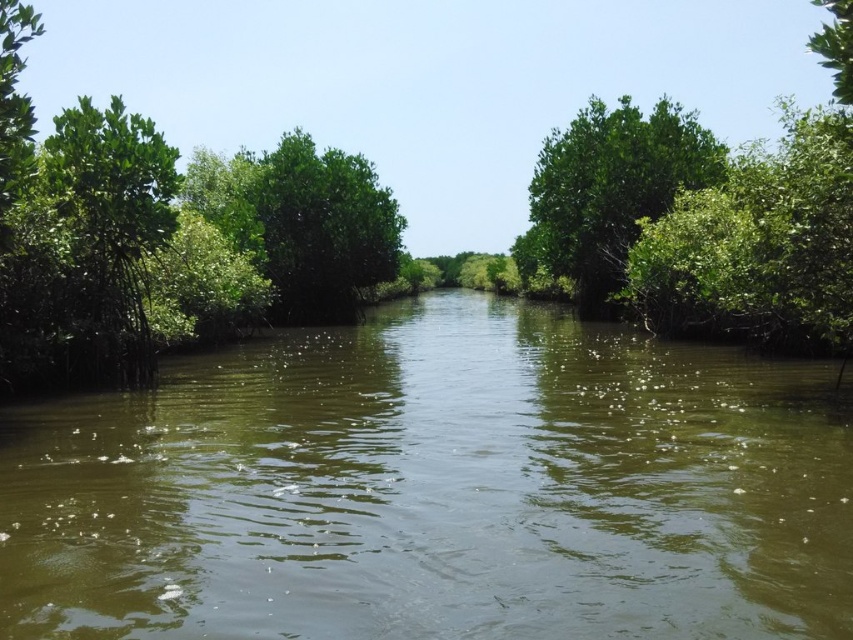
You are a boat captain navigating a narrow waterway. You see the green murky water at center and the green leafy tree at center. Which one takes up more space in the scene?

The green leafy tree at center occupies more space than the green murky water at center, so the tree takes up more space in the scene.

You are navigating a small boat along the waterway in the serene mangrove ecosystem. You notice two points marked on your map at coordinates point (6, 513) and point (570, 177). According to the map, which point is closer to your current position if you are facing the direction of the waterway?

Point (6, 513) is in front of point (570, 177), so if you are facing the direction of the waterway, point (6, 513) is closer to your current position.